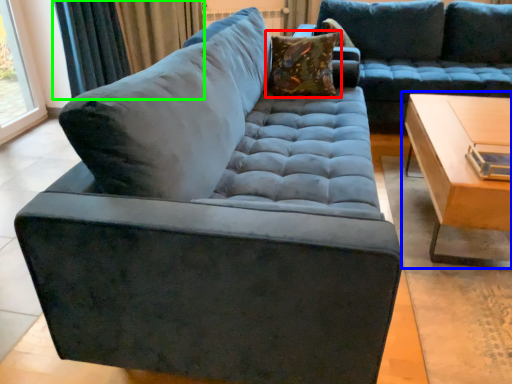
Question: Estimate the real-world distances between objects in this image. Which object is farther from pillow (highlighted by a red box), table (highlighted by a blue box) or curtain (highlighted by a green box)?

Choices:
 (A) table
 (B) curtain

Answer: (B)